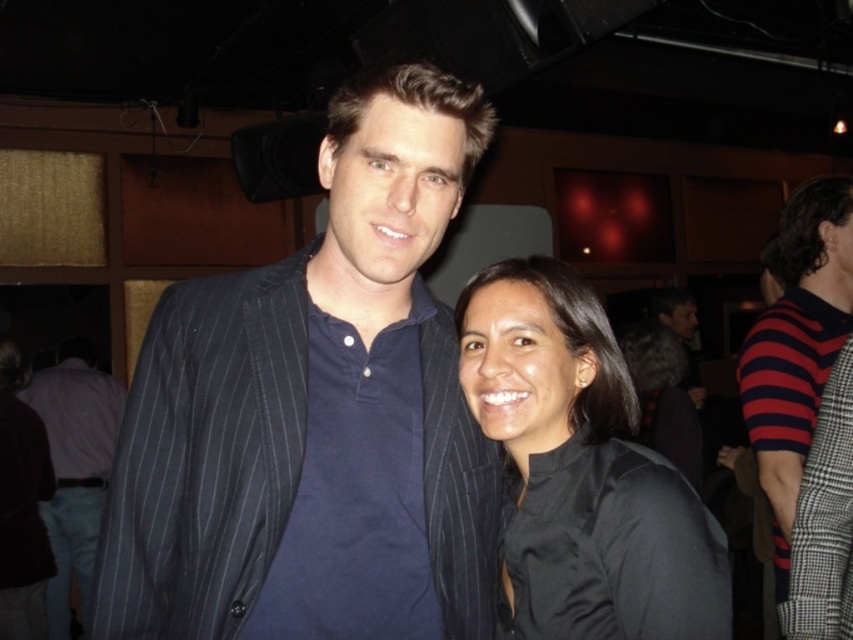
Question: Which of the following is the closest to the observer?

Choices:
 (A) (177, 340)
 (B) (511, 323)

Answer: (B)

Question: Which object is farther from the camera taking this photo?

Choices:
 (A) dark blue pinstripe suit at center
 (B) light blue cotton shirt at center
 (C) red and navy striped sweater at right
 (D) black matte shirt at center

Answer: (B)

Question: Is black matte shirt at center behind red and navy striped sweater at right?

Choices:
 (A) yes
 (B) no

Answer: (B)

Question: Is dark blue pinstripe suit at center positioned in front of light blue cotton shirt at center?

Choices:
 (A) yes
 (B) no

Answer: (A)

Question: Where is black matte shirt at center located in relation to light blue cotton shirt at center in the image?

Choices:
 (A) left
 (B) right

Answer: (B)

Question: Which of the following is the farthest from the observer?

Choices:
 (A) (773, 330)
 (B) (608, 422)
 (C) (375, 600)
 (D) (56, 588)

Answer: (D)